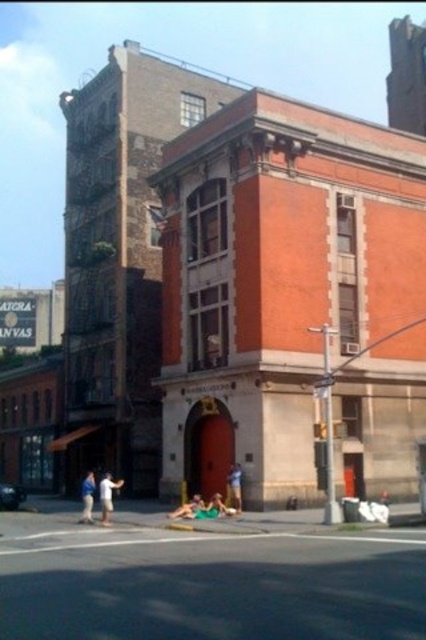
You are a photographer trying to capture a shot of the blue denim shorts at lower left and the green fabric person at lower center. Which object should you zoom in on to ensure both are in focus without moving your position?

The blue denim shorts at lower left is bigger than the green fabric person at lower center, so you should zoom in on the blue denim shorts at lower left to ensure both are in focus.